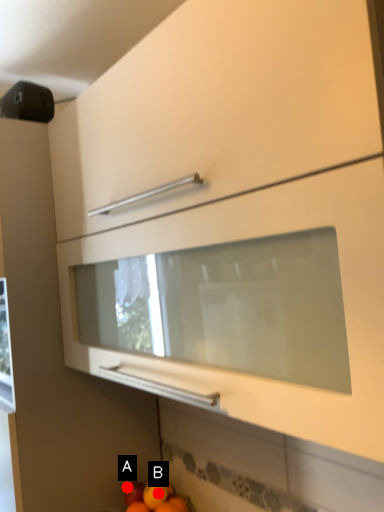
Question: Two points are circled on the image, labeled by A and B beside each circle. Which point appears closest to the camera in this image?

Choices:
 (A) A is closer
 (B) B is closer

Answer: (B)